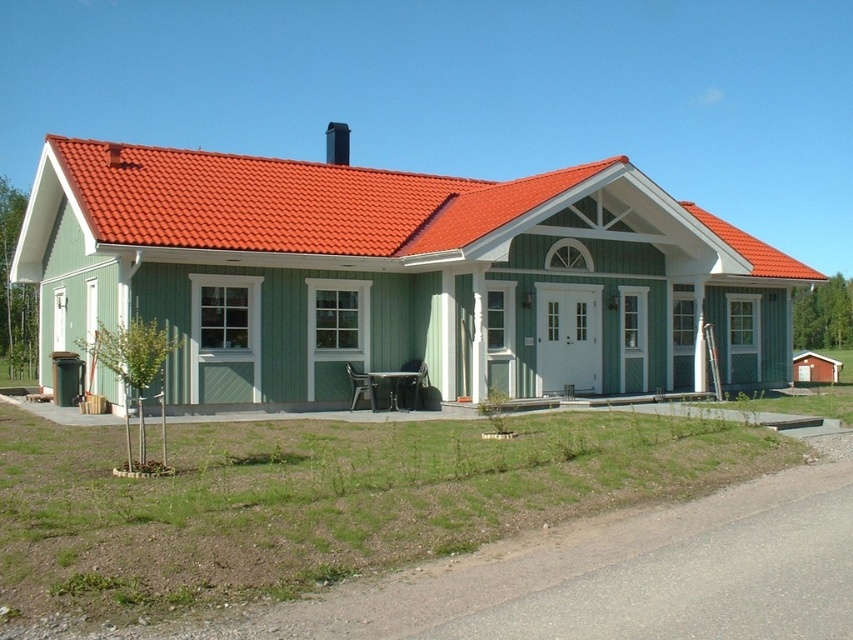
You are a painter planning to paint the house. You need to know which object, the red tile roof at upper center or the black smooth chimney at upper center, requires more paint because it is bigger. Which one is it?

The red tile roof at upper center requires more paint because it is larger in size than the black smooth chimney at upper center.

You are a painter standing at the base of the house, looking up at the red tile roof at upper center and the black smooth chimney at upper center. You need to reach the closest one to apply a fresh coat of paint. Which one should you aim for?

Both the red tile roof at upper center and the black smooth chimney at upper center are at the same distance from you since they are both located at upper center. However, the distance between them is 7.19 meters, so you need to determine which is closer based on their positions. Since they are at the same vertical position, their horizontal distance apart is 7.19 meters. Therefore, you would need to choose based on which is closer horizontally, but since the problem states they are both at upper center, it

You are standing in front of the house and notice the red tile roof at upper center and the black smooth chimney at upper center. Which object is closer to you?

The red tile roof at upper center is closer because it is in front of the black smooth chimney at upper center.